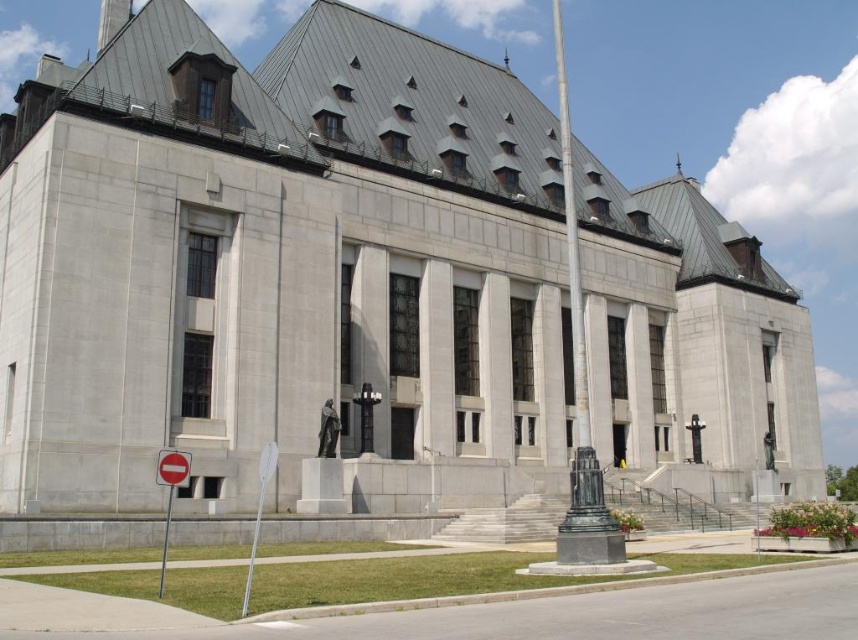
Can you confirm if metallic reflective sign at lower left is bigger than red plastic sign at lower left?

Indeed, metallic reflective sign at lower left has a larger size compared to red plastic sign at lower left.

Does point (166, 524) lie in front of point (162, 468)?

No, it is not.

Find the location of a particular element. This screenshot has width=858, height=640. metallic reflective sign at lower left is located at coordinates (170, 493).

What do you see at coordinates (579, 387) in the screenshot?
I see `bronze flagpole at center` at bounding box center [579, 387].

Find the location of `bronze flagpole at center`. bronze flagpole at center is located at coordinates [579, 387].

Who is taller, metallic reflective sign at lower left or white plastic sign at lower left?

Standing taller between the two is white plastic sign at lower left.

Which is below, metallic reflective sign at lower left or white plastic sign at lower left?

Positioned lower is white plastic sign at lower left.

In order to click on metallic reflective sign at lower left in this screenshot , I will do `click(170, 493)`.

Locate an element on the screen. metallic reflective sign at lower left is located at coordinates (170, 493).